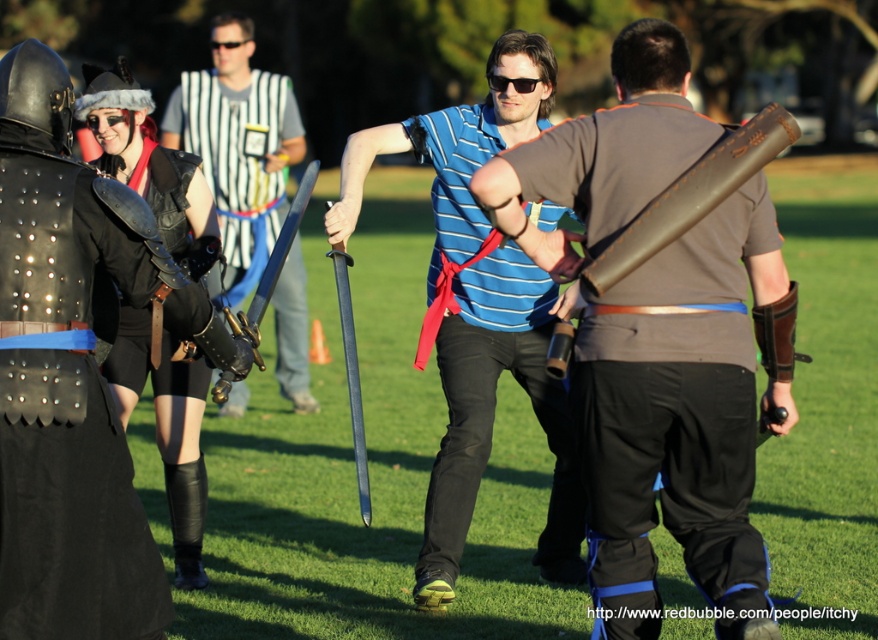
You are a knight in the medieval event and you need to grab a sword quickly. There are two swords at the center of the scene. Which one is closer to you, the shiny blue sword at center or the polished steel sword at center?

The shiny blue sword at center is closer to you because it is further to the viewer than the polished steel sword at center.

Based on the photo, you are at a medieval event and see the matte brown leather sword at center and the blue striped shirt at center. Which object is positioned to the right of the other?

The matte brown leather sword at center is to the right of the blue striped shirt at center.

Looking at this image, you are standing in the medieval event area and see two points marked in the scene. Which point, point (468, 490) or point (776, 134), is closer to you?

Point (468, 490) is closer to you because it is further to the viewer than point (776, 134).